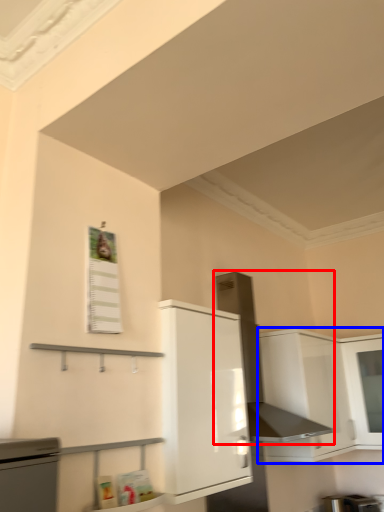
Question: Which object appears farthest to the camera in this image, exhaust hood (highlighted by a red box) or cabinetry (highlighted by a blue box)?

Choices:
 (A) exhaust hood
 (B) cabinetry

Answer: (B)